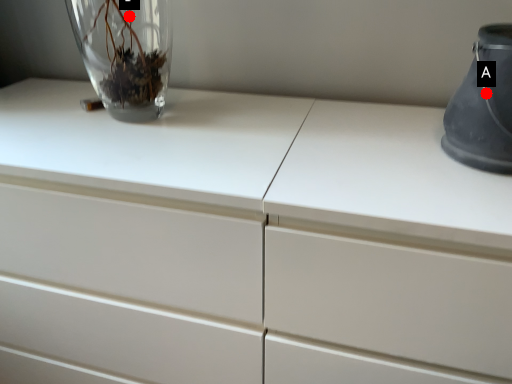
Question: Two points are circled on the image, labeled by A and B beside each circle. Among these points, which one is farthest from the camera?

Choices:
 (A) A is further
 (B) B is further

Answer: (B)